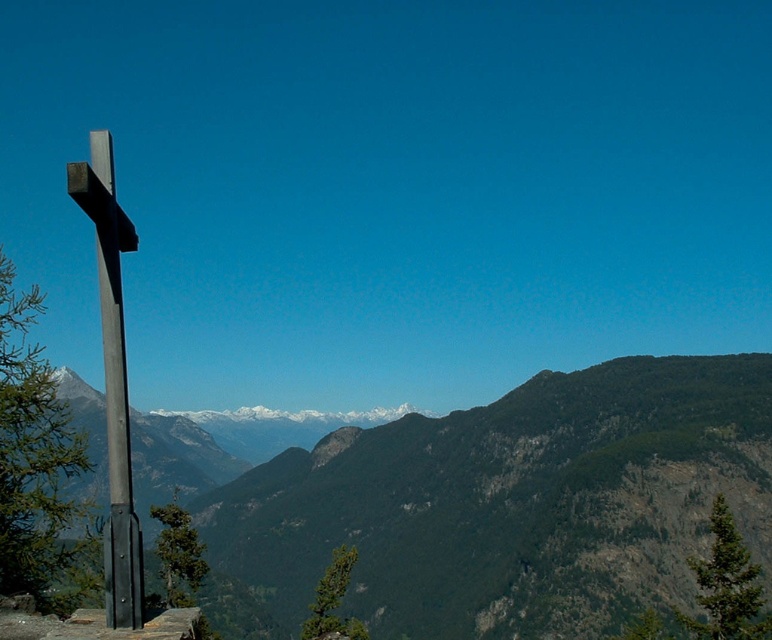
Can you confirm if green textured mountain range at center is thinner than black metal cross at left?

Incorrect, green textured mountain range at center's width is not less than black metal cross at left's.

Which is behind, point (293, 513) or point (103, 259)?

The point (293, 513) is more distant.

Locate an element on the screen. green textured mountain range at center is located at coordinates (506, 506).

The width and height of the screenshot is (772, 640). I want to click on green textured mountain range at center, so click(506, 506).